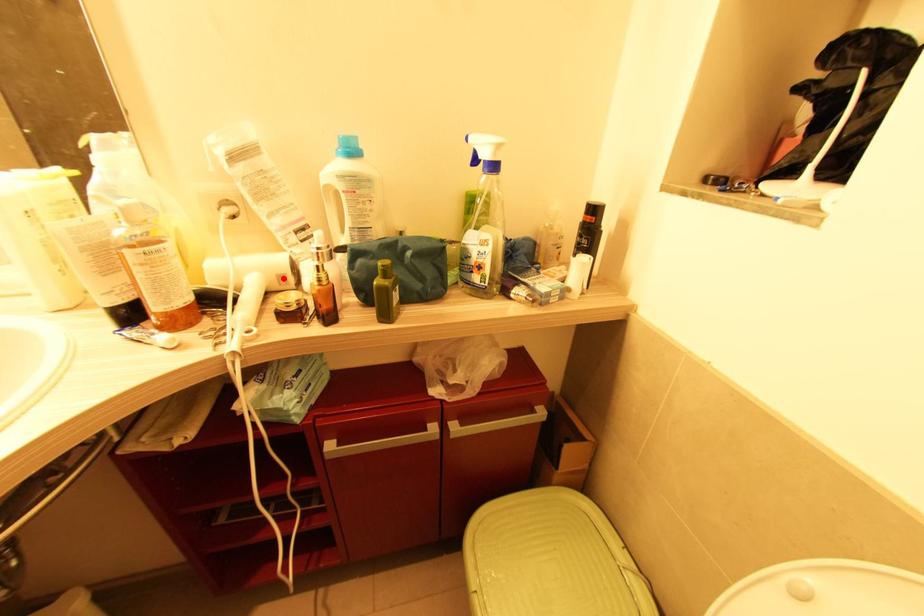
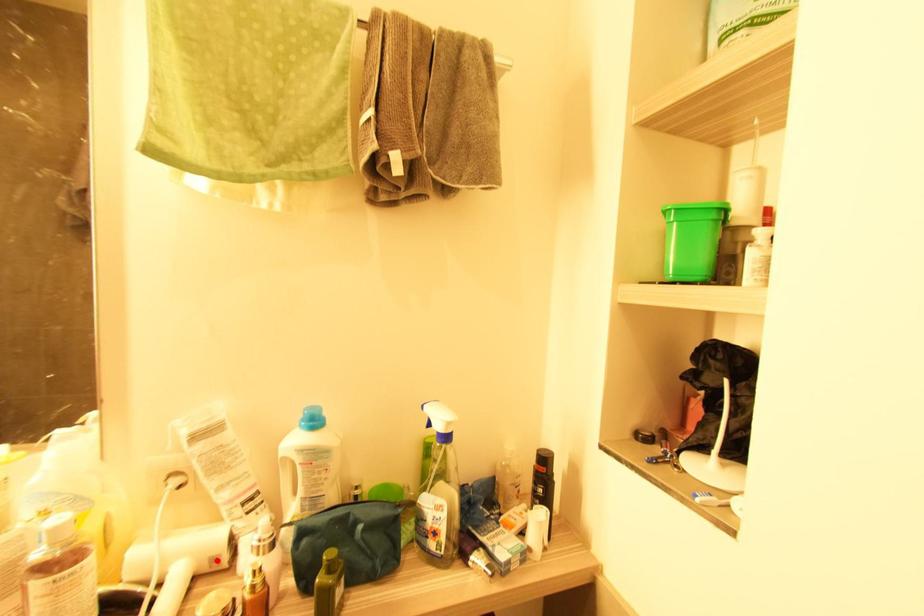
I am providing you with two images of the same scene from different viewpoints. A red point is marked on the first image and another point is marked on the second image. Does the point marked in image1 correspond to the same location as the one in image2?

Yes